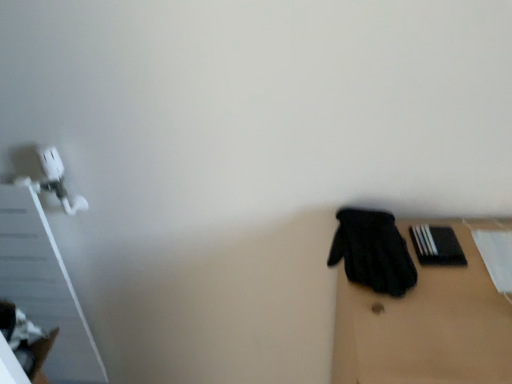
Question: Is black matte gloves at right positioned beyond the bounds of black matte book at right?

Choices:
 (A) no
 (B) yes

Answer: (B)

Question: Can you confirm if black matte gloves at right is positioned to the left of black matte book at right?

Choices:
 (A) no
 (B) yes

Answer: (A)

Question: From the image's perspective, is black matte gloves at right on black matte book at right?

Choices:
 (A) no
 (B) yes

Answer: (A)

Question: Can you confirm if black matte gloves at right is bigger than black matte book at right?

Choices:
 (A) yes
 (B) no

Answer: (A)

Question: Are black matte gloves at right and black matte book at right making contact?

Choices:
 (A) no
 (B) yes

Answer: (A)

Question: Looking at their shapes, would you say black fabric glove at right is wider or thinner than black matte gloves at right?

Choices:
 (A) thin
 (B) wide

Answer: (A)

Question: Is black fabric glove at right inside the boundaries of black matte gloves at right, or outside?

Choices:
 (A) inside
 (B) outside

Answer: (A)

Question: Is black fabric glove at right in front of or behind black matte gloves at right in the image?

Choices:
 (A) behind
 (B) front

Answer: (A)

Question: From a real-world perspective, is black fabric glove at right above or below black matte gloves at right?

Choices:
 (A) below
 (B) above

Answer: (B)

Question: In the image, is black matte gloves at right on the left side or the right side of black fabric glove at right?

Choices:
 (A) left
 (B) right

Answer: (B)

Question: Is point (449, 271) positioned closer to the camera than point (356, 258)?

Choices:
 (A) closer
 (B) farther

Answer: (A)

Question: From a real-world perspective, is black matte gloves at right positioned above or below black fabric glove at right?

Choices:
 (A) below
 (B) above

Answer: (A)

Question: In terms of height, does black matte gloves at right look taller or shorter compared to black fabric glove at right?

Choices:
 (A) tall
 (B) short

Answer: (A)

Question: Based on their sizes in the image, would you say black fabric glove at right is bigger or smaller than black matte book at right?

Choices:
 (A) big
 (B) small

Answer: (A)

Question: From a real-world perspective, is black fabric glove at right positioned above or below black matte book at right?

Choices:
 (A) above
 (B) below

Answer: (A)